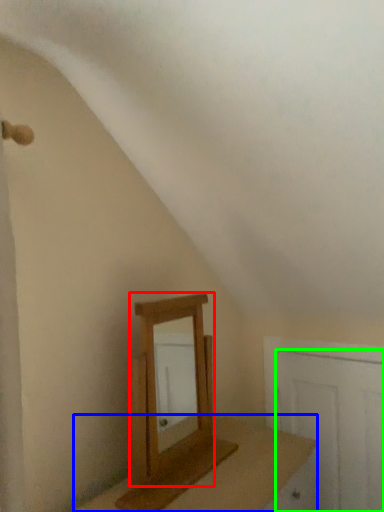
Question: Which is nearer to the mirror (highlighted by a red box)? table (highlighted by a blue box) or door (highlighted by a green box).

Choices:
 (A) table
 (B) door

Answer: (A)